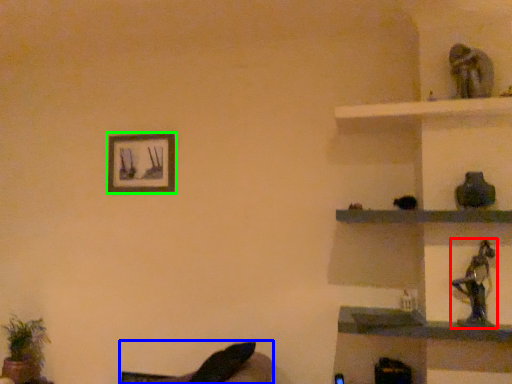
Question: Which object is positioned closest to toy (highlighted by a red box)? Select from swivel chair (highlighted by a blue box) and picture frame (highlighted by a green box).

Choices:
 (A) swivel chair
 (B) picture frame

Answer: (A)